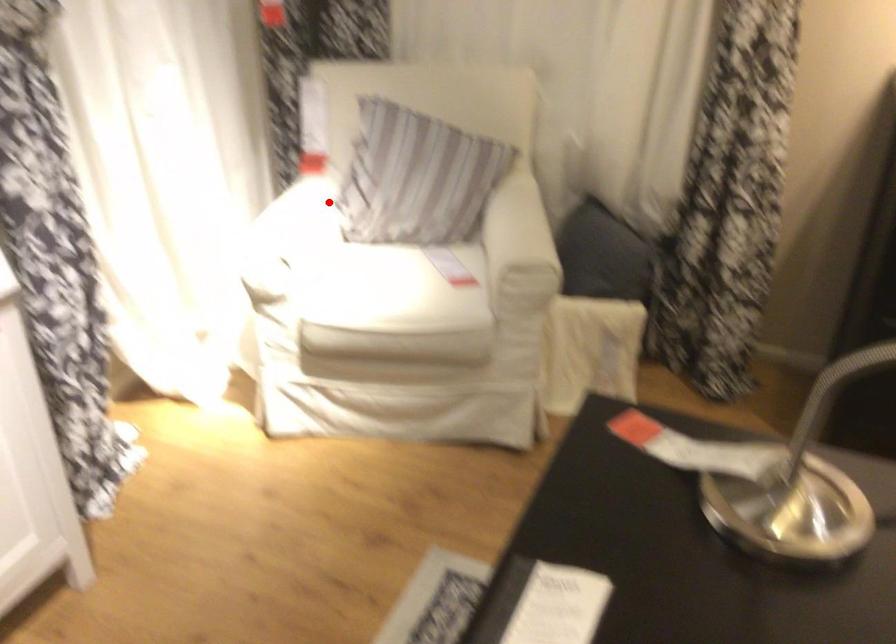
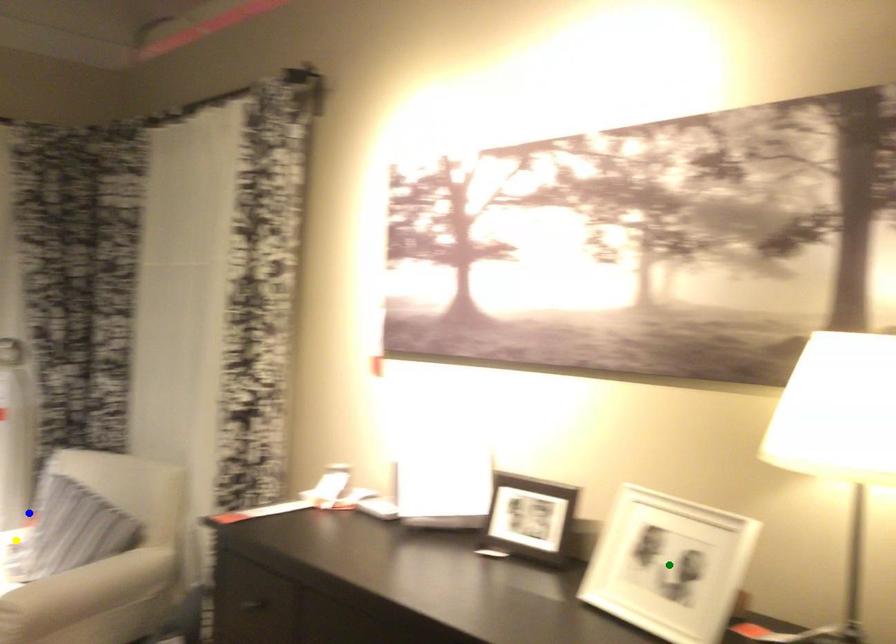
Question: I am providing you with two images of the same scene from different viewpoints. A red point is marked on the first image. You are given multiple points on the second image. Can you choose the point in image 2 that corresponds to the point in image 1?

Choices:
 (A) green point
 (B) yellow point
 (C) blue point

Answer: (B)